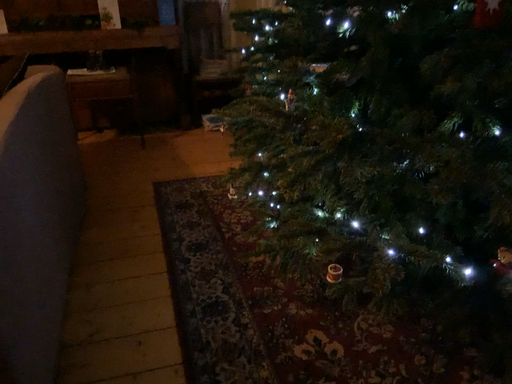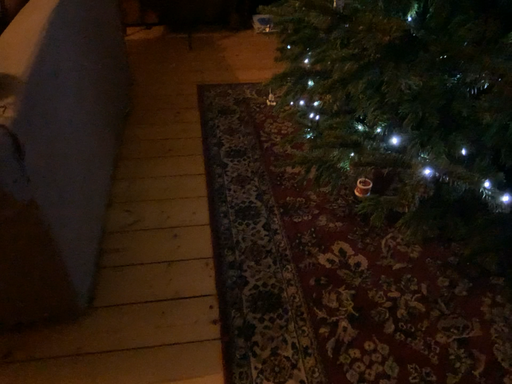
Question: Which way did the camera rotate in the video?

Choices:
 (A) rotated right
 (B) rotated left

Answer: (B)